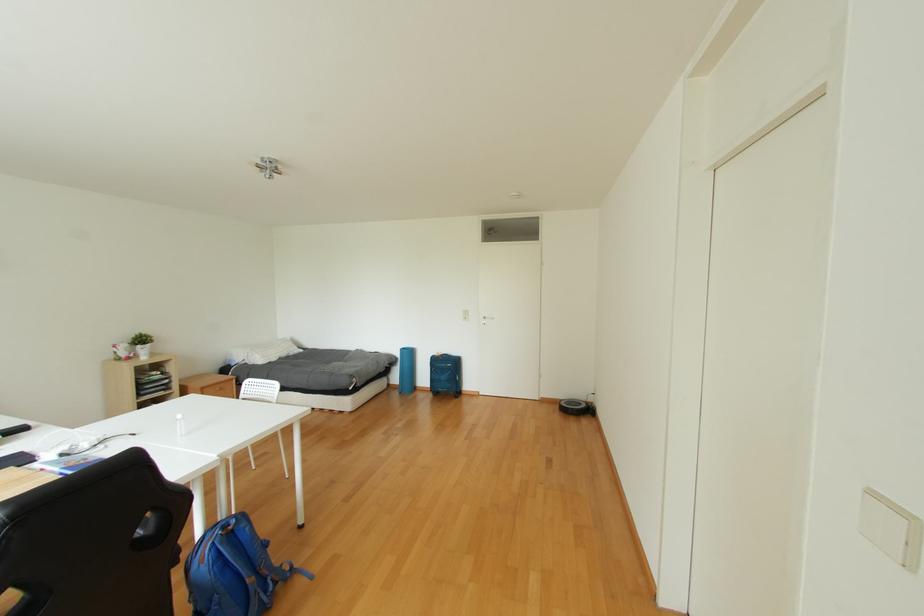
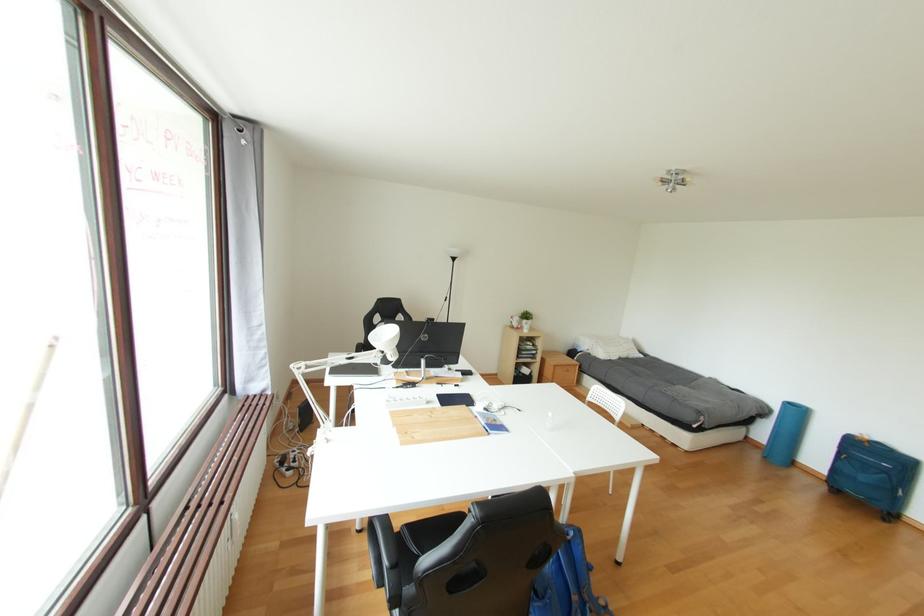
Question: The camera is either moving clockwise (left) or counter-clockwise (right) around the object. The first image is from the beginning of the video and the second image is from the end. Is the camera moving left or right when shooting the video?

Choices:
 (A) Left
 (B) Right

Answer: (B)